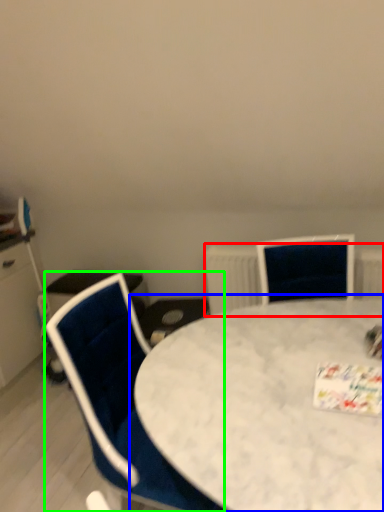
Question: Which object is positioned closest to radiator (highlighted by a red box)? Select from table (highlighted by a blue box) and chair (highlighted by a green box).

Choices:
 (A) table
 (B) chair

Answer: (A)